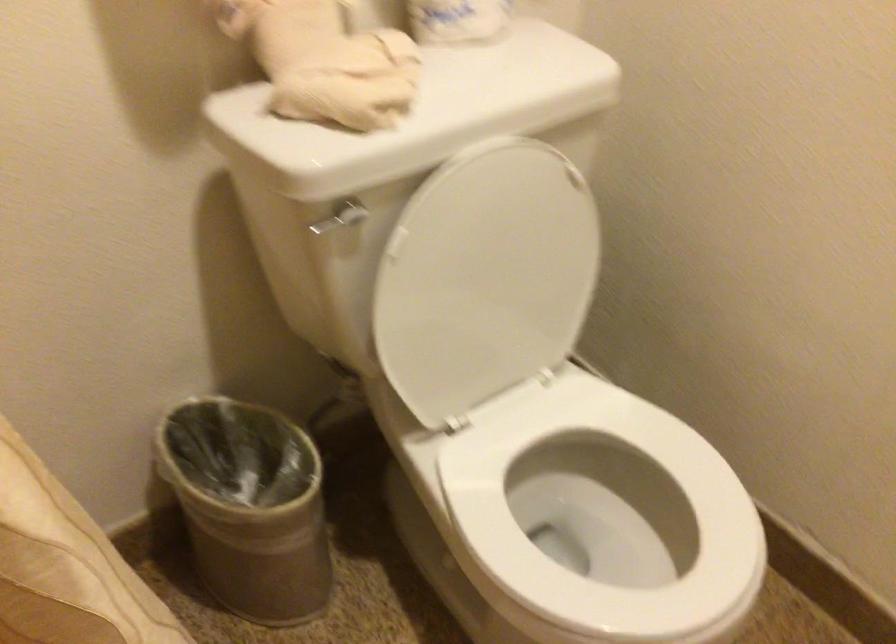
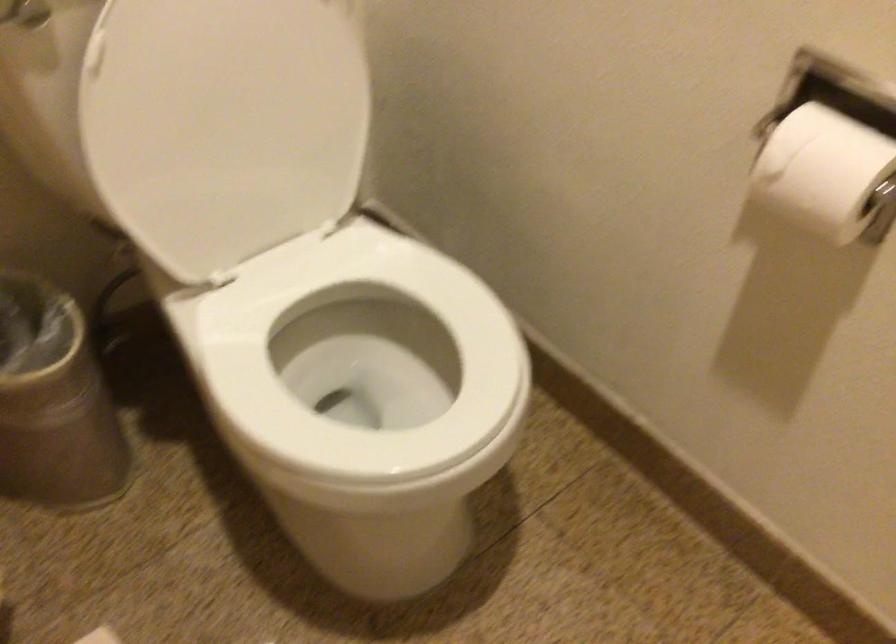
Where in the second image is the point corresponding to (x=493, y=281) from the first image?

(239, 114)